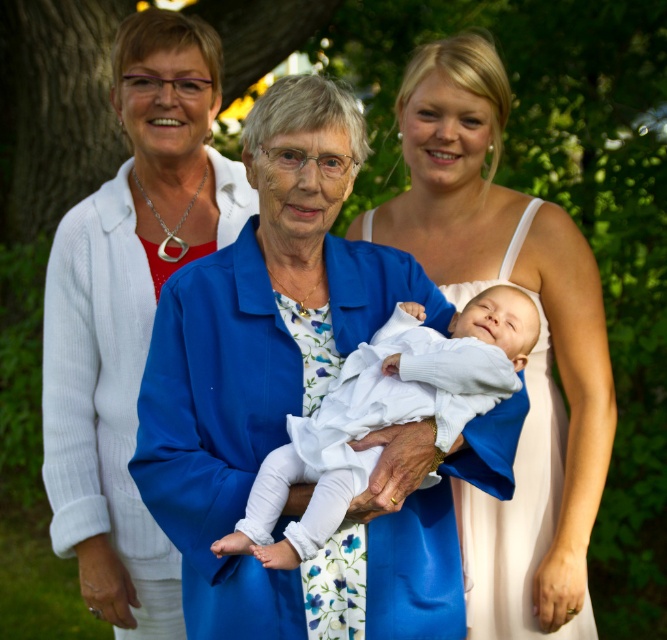
You are a photographer trying to capture the elderly woman and the baby in the image. Since both are wearing white, you need to adjust your camera settings to avoid overexposure. Which object, the white satin jacket at left or the white soft fabric baby at center, is closer to the left side of the frame to help you focus?

The white satin jacket at left is positioned on the left side of the white soft fabric baby at center, so it is closer to the left side of the frame.